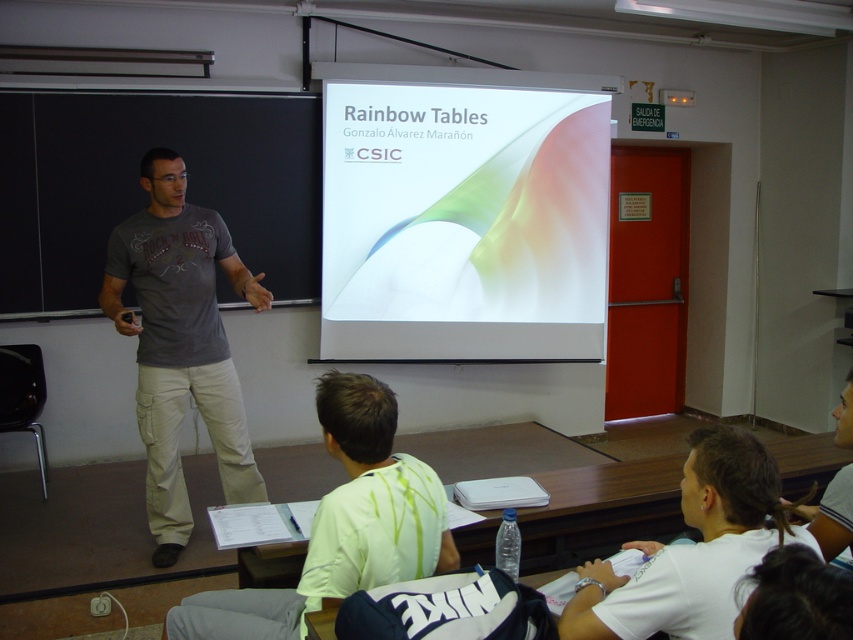
The width and height of the screenshot is (853, 640). In order to click on blackboard at left in this screenshot , I will do `click(142, 189)`.

Which is more to the left, blackboard at left or white cotton shirt at lower right?

Positioned to the left is blackboard at left.

Image resolution: width=853 pixels, height=640 pixels. What do you see at coordinates (142, 189) in the screenshot? I see `blackboard at left` at bounding box center [142, 189].

The height and width of the screenshot is (640, 853). I want to click on blackboard at left, so click(x=142, y=189).

Is point (432, 520) closer to viewer compared to point (583, 588)?

No.

Is light green fabric shirt at lower center above white cotton shirt at lower right?

Incorrect, light green fabric shirt at lower center is not positioned above white cotton shirt at lower right.

Find the location of a particular element. This screenshot has width=853, height=640. light green fabric shirt at lower center is located at coordinates (341, 524).

The image size is (853, 640). Find the location of `light green fabric shirt at lower center`. light green fabric shirt at lower center is located at coordinates (341, 524).

Is gray cotton t-shirt at center above white cotton shirt at lower right?

Correct, gray cotton t-shirt at center is located above white cotton shirt at lower right.

Consider the image. Does gray cotton t-shirt at center have a lesser width compared to white cotton shirt at lower right?

No.

Image resolution: width=853 pixels, height=640 pixels. Find the location of `gray cotton t-shirt at center`. gray cotton t-shirt at center is located at coordinates pos(180,342).